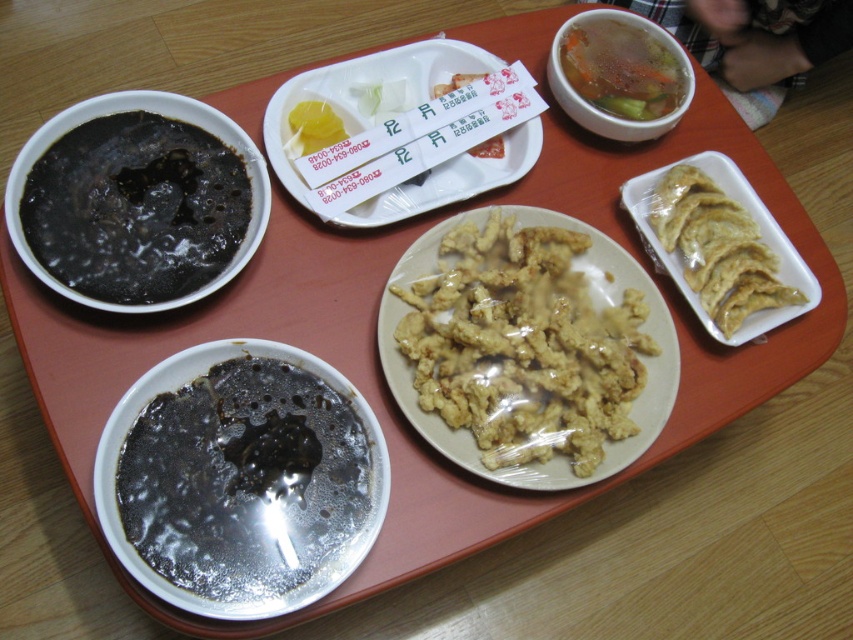
You are a food delivery person who just arrived at the customer. You see the golden crispy fried chicken at center and the white paper receipt at center on the red tray. Which item is closer to you?

The golden crispy fried fried chicken at center is closer to you because it is in front of the white paper receipt at center.

In the scene shown: You are a food delivery person who needs to carry this tray. The tray has the black glossy soup at lower left and translucent plastic dumplings at right. Which of these two items takes up more space on the tray?

The black glossy soup at lower left takes up more space on the tray because it has a larger size compared to the translucent plastic dumplings at right.